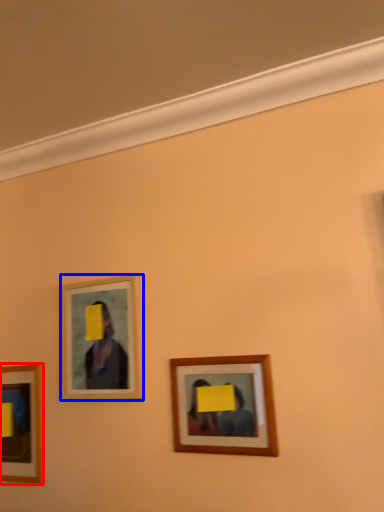
Question: Which object is further to the camera taking this photo, picture frame (highlighted by a red box) or picture frame (highlighted by a blue box)?

Choices:
 (A) picture frame
 (B) picture frame

Answer: (A)